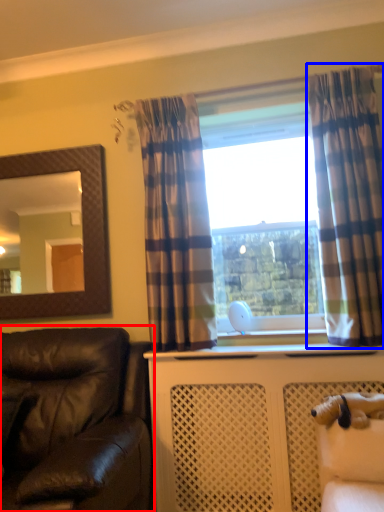
Question: Which object appears farthest to the camera in this image, studio couch (highlighted by a red box) or curtain (highlighted by a blue box)?

Choices:
 (A) studio couch
 (B) curtain

Answer: (B)